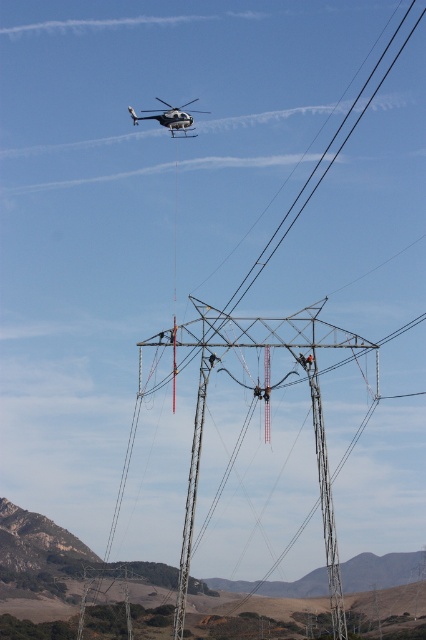
Question: Is metallic silver tower at center positioned before white glossy helicopter at upper center?

Choices:
 (A) no
 (B) yes

Answer: (B)

Question: Which of the following is the closest to the observer?

Choices:
 (A) white glossy helicopter at upper center
 (B) metallic silver tower at center

Answer: (B)

Question: Which point is farther from the camera taking this photo?

Choices:
 (A) (167, 115)
 (B) (348, 344)

Answer: (A)

Question: Is metallic silver tower at center above white glossy helicopter at upper center?

Choices:
 (A) yes
 (B) no

Answer: (B)

Question: Does metallic silver tower at center appear on the right side of white glossy helicopter at upper center?

Choices:
 (A) yes
 (B) no

Answer: (A)